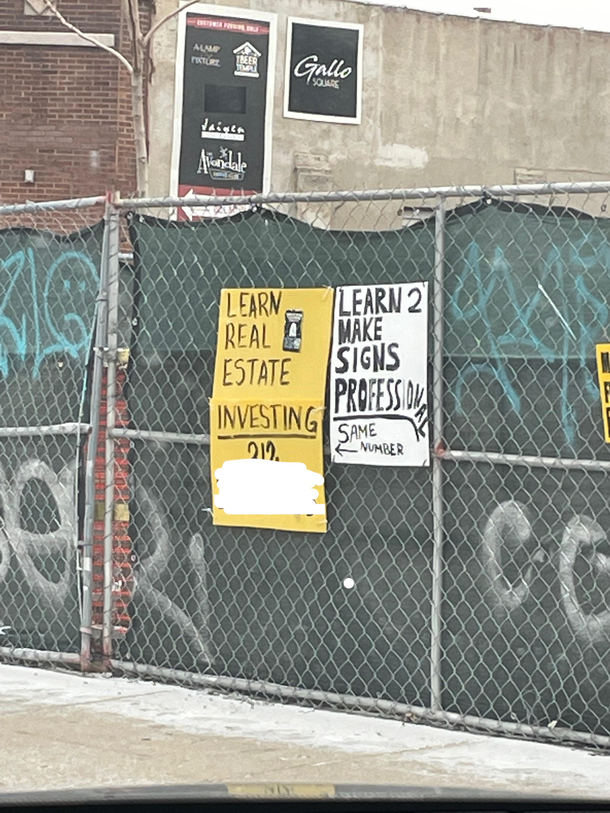
Locate an element on the screen. The width and height of the screenshot is (610, 813). poster is located at coordinates (267, 383).